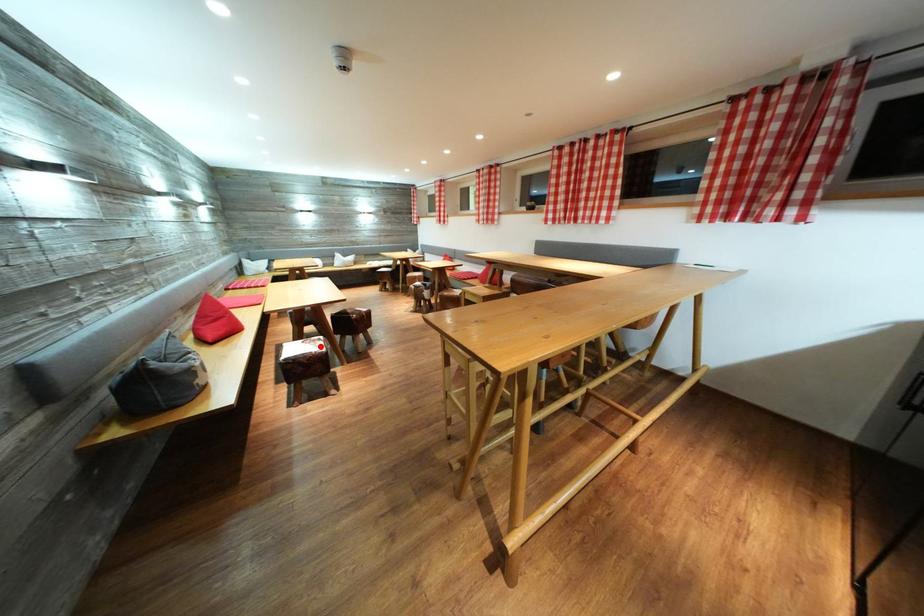
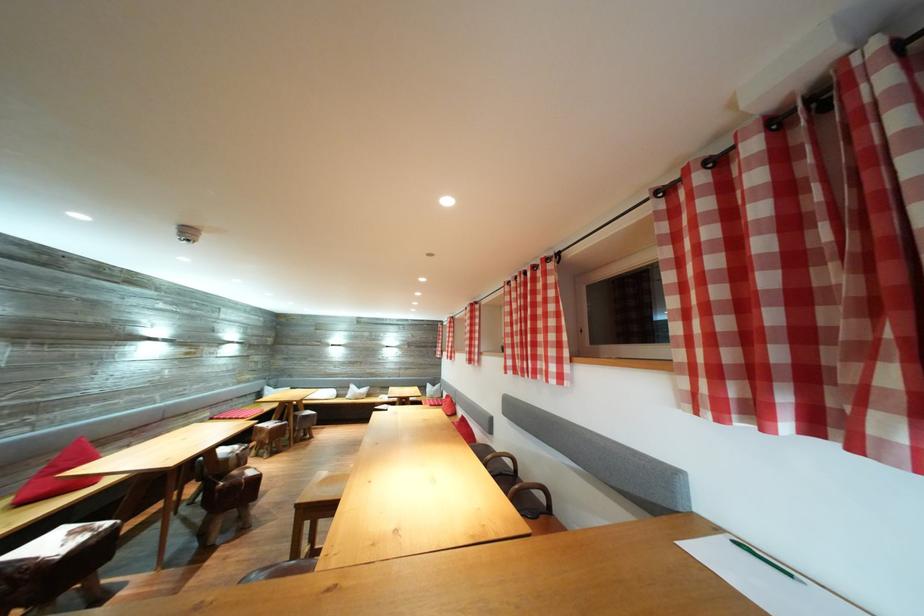
Where in the second image is the point corresponding to the highlighted location from the first image?

(91, 536)